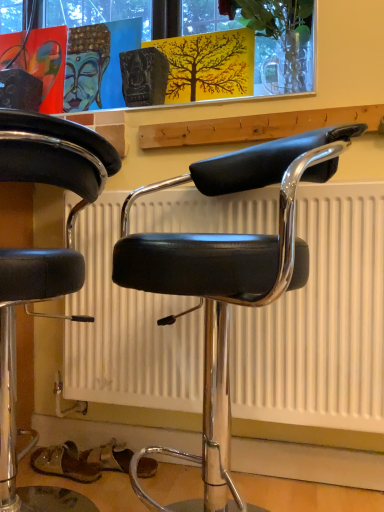
What do you see at coordinates (42, 267) in the screenshot? I see `black leather stool at left, marked as the 1th chair in a left-to-right arrangement` at bounding box center [42, 267].

What do you see at coordinates (227, 275) in the screenshot? This screenshot has height=512, width=384. I see `black leather chair at center, which is the 1th chair from right to left` at bounding box center [227, 275].

Locate an element on the screen. The image size is (384, 512). translucent glass vase at upper center is located at coordinates (280, 39).

In order to click on black leather stool at left, which is counted as the 2th chair, starting from the right in this screenshot , I will do `click(42, 267)`.

Between translucent glass vase at upper center and black leather stool at left, which is counted as the 2th chair, starting from the right, which one has smaller width?

With smaller width is translucent glass vase at upper center.

Is translucent glass vase at upper center located outside black leather stool at left, which is counted as the 2th chair, starting from the right?

translucent glass vase at upper center lies outside black leather stool at left, which is counted as the 2th chair, starting from the right,'s area.

Where is `plant on the right side of black leather stool at left, marked as the 1th chair in a left-to-right arrangement`? This screenshot has height=512, width=384. plant on the right side of black leather stool at left, marked as the 1th chair in a left-to-right arrangement is located at coordinates (280, 39).

Looking at this image, can you see black leather chair at center, which is counted as the 2th chair, starting from the left, touching translucent glass vase at upper center?

There is a gap between black leather chair at center, which is counted as the 2th chair, starting from the left, and translucent glass vase at upper center.

Is point (210, 240) farther from camera compared to point (261, 21)?

No, it is in front of (261, 21).

Is black leather chair at center, which is counted as the 2th chair, starting from the left, at the left side of translucent glass vase at upper center?

Indeed, black leather chair at center, which is counted as the 2th chair, starting from the left, is positioned on the left side of translucent glass vase at upper center.

How many degrees apart are the facing directions of black leather stool at left, marked as the 1th chair in a left-to-right arrangement, and black leather chair at center, which is the 1th chair from right to left?

The facing directions of black leather stool at left, marked as the 1th chair in a left-to-right arrangement, and black leather chair at center, which is the 1th chair from right to left, are 87.9 degrees apart.

From a real-world perspective, is black leather stool at left, which is counted as the 2th chair, starting from the right, over black leather chair at center, which is the 1th chair from right to left?

No, from a real-world perspective, black leather stool at left, which is counted as the 2th chair, starting from the right, is not above black leather chair at center, which is the 1th chair from right to left.

Which is correct: black leather stool at left, which is counted as the 2th chair, starting from the right, is inside black leather chair at center, which is the 1th chair from right to left, or outside of it?

black leather stool at left, which is counted as the 2th chair, starting from the right, is not inside black leather chair at center, which is the 1th chair from right to left, it's outside.

Which of these two, black leather stool at left, marked as the 1th chair in a left-to-right arrangement, or black leather chair at center, which is the 1th chair from right to left, stands taller?

black leather stool at left, marked as the 1th chair in a left-to-right arrangement.

Are black leather chair at center, which is counted as the 2th chair, starting from the left, and black leather stool at left, marked as the 1th chair in a left-to-right arrangement, beside each other?

black leather chair at center, which is counted as the 2th chair, starting from the left, and black leather stool at left, marked as the 1th chair in a left-to-right arrangement, are not in contact.

Is the position of black leather chair at center, which is the 1th chair from right to left, less distant than that of black leather stool at left, which is counted as the 2th chair, starting from the right?

No, the depth of black leather chair at center, which is the 1th chair from right to left, is greater than that of black leather stool at left, which is counted as the 2th chair, starting from the right.

Considering the positions of objects black leather chair at center, which is the 1th chair from right to left, and black leather stool at left, which is counted as the 2th chair, starting from the right, in the image provided, who is more to the right, black leather chair at center, which is the 1th chair from right to left, or black leather stool at left, which is counted as the 2th chair, starting from the right,?

Positioned to the right is black leather chair at center, which is the 1th chair from right to left.

From the image's perspective, which is below, black leather chair at center, which is the 1th chair from right to left, or black leather stool at left, which is counted as the 2th chair, starting from the right?

black leather stool at left, which is counted as the 2th chair, starting from the right, appears lower in the image.

Who is bigger, black leather stool at left, marked as the 1th chair in a left-to-right arrangement, or translucent glass vase at upper center?

Bigger between the two is black leather stool at left, marked as the 1th chair in a left-to-right arrangement.

The height and width of the screenshot is (512, 384). Identify the location of plant behind the black leather stool at left, which is counted as the 2th chair, starting from the right. [280, 39].

Between black leather stool at left, which is counted as the 2th chair, starting from the right, and translucent glass vase at upper center, which one has more height?

black leather stool at left, which is counted as the 2th chair, starting from the right.

Visually, is black leather stool at left, marked as the 1th chair in a left-to-right arrangement, positioned to the left or to the right of translucent glass vase at upper center?

Clearly, black leather stool at left, marked as the 1th chair in a left-to-right arrangement, is on the left of translucent glass vase at upper center in the image.

In order to click on chair that is the 1st object located below the translucent glass vase at upper center (from the image's perspective) in this screenshot , I will do `click(227, 275)`.

Is translucent glass vase at upper center facing towards black leather chair at center, which is counted as the 2th chair, starting from the left?

No.

Considering the positions of objects translucent glass vase at upper center and black leather chair at center, which is the 1th chair from right to left, in the image provided, who is more to the right, translucent glass vase at upper center or black leather chair at center, which is the 1th chair from right to left,?

translucent glass vase at upper center.

Considering the relative sizes of translucent glass vase at upper center and black leather chair at center, which is the 1th chair from right to left, in the image provided, is translucent glass vase at upper center smaller than black leather chair at center, which is the 1th chair from right to left,?

Yes, translucent glass vase at upper center is smaller than black leather chair at center, which is the 1th chair from right to left.

In order to click on chair that is the 2nd object located below the translucent glass vase at upper center (from the image's perspective) in this screenshot , I will do `click(42, 267)`.

Find the location of `plant located above the black leather chair at center, which is counted as the 2th chair, starting from the left (from a real-world perspective)`. plant located above the black leather chair at center, which is counted as the 2th chair, starting from the left (from a real-world perspective) is located at coordinates (280, 39).

Estimate the real-world distances between objects in this image. Which object is closer to translucent glass vase at upper center, black leather stool at left, marked as the 1th chair in a left-to-right arrangement, or black leather chair at center, which is the 1th chair from right to left?

Among the two, black leather chair at center, which is the 1th chair from right to left, is located nearer to translucent glass vase at upper center.

Which object lies nearer to the anchor point black leather chair at center, which is the 1th chair from right to left, translucent glass vase at upper center or black leather stool at left, marked as the 1th chair in a left-to-right arrangement?

black leather stool at left, marked as the 1th chair in a left-to-right arrangement.

When comparing their distances from black leather chair at center, which is the 1th chair from right to left, does black leather stool at left, which is counted as the 2th chair, starting from the right, or translucent glass vase at upper center seem closer?

Among the two, black leather stool at left, which is counted as the 2th chair, starting from the right, is located nearer to black leather chair at center, which is the 1th chair from right to left.

Estimate the real-world distances between objects in this image. Which object is further from translucent glass vase at upper center, black leather chair at center, which is the 1th chair from right to left, or black leather stool at left, which is counted as the 2th chair, starting from the right?

black leather stool at left, which is counted as the 2th chair, starting from the right.

Based on their spatial positions, is translucent glass vase at upper center or black leather chair at center, which is the 1th chair from right to left, closer to black leather stool at left, which is counted as the 2th chair, starting from the right?

black leather chair at center, which is the 1th chair from right to left, is closer to black leather stool at left, which is counted as the 2th chair, starting from the right.

Considering their positions, is black leather chair at center, which is counted as the 2th chair, starting from the left, positioned further to black leather stool at left, which is counted as the 2th chair, starting from the right, than translucent glass vase at upper center?

translucent glass vase at upper center is further to black leather stool at left, which is counted as the 2th chair, starting from the right.

Identify the location of chair that lies between translucent glass vase at upper center and black leather stool at left, which is counted as the 2th chair, starting from the right, from top to bottom. This screenshot has height=512, width=384. (227, 275).